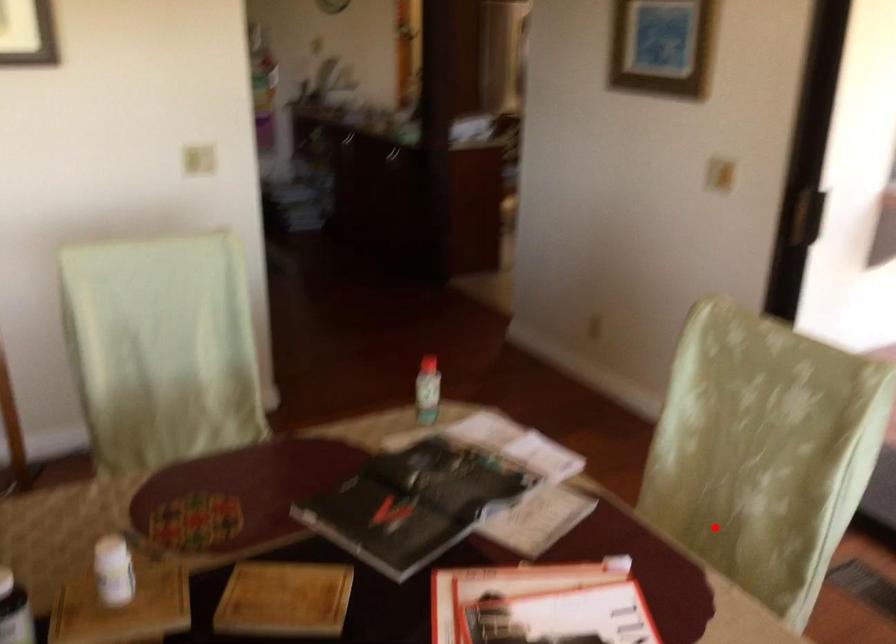
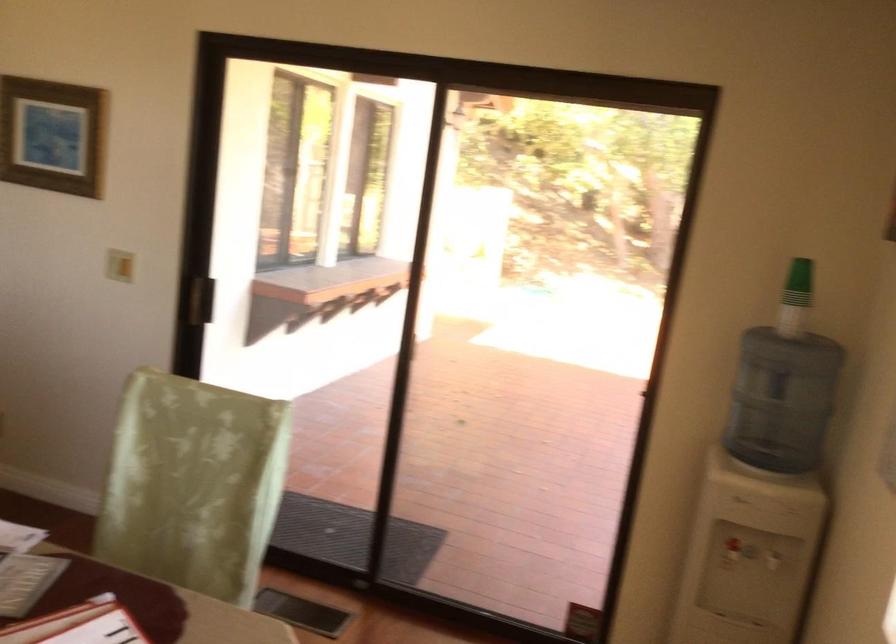
In the second image, find the point that corresponds to the highlighted location in the first image.

(168, 565)